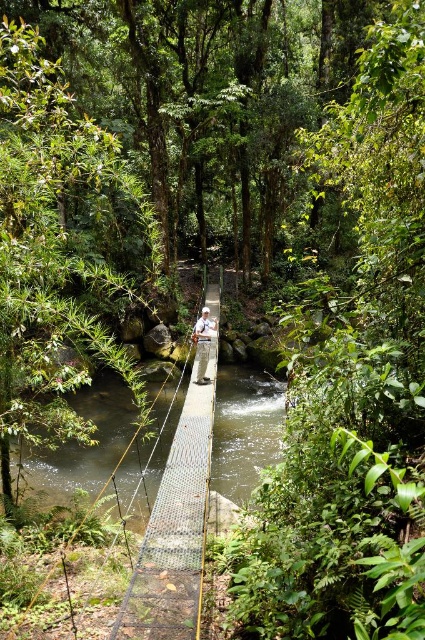
Question: Which point is closer to the camera?

Choices:
 (A) white fabric shirt at center
 (B) clear water at bridge center

Answer: (B)

Question: Does clear water at bridge center come behind white fabric shirt at center?

Choices:
 (A) yes
 (B) no

Answer: (B)

Question: Where is clear water at bridge center located in relation to white fabric shirt at center in the image?

Choices:
 (A) left
 (B) right

Answer: (A)

Question: Can you confirm if clear water at bridge center is smaller than white fabric shirt at center?

Choices:
 (A) yes
 (B) no

Answer: (B)

Question: Which point is closer to the camera?

Choices:
 (A) clear water at bridge center
 (B) white fabric shirt at center

Answer: (A)

Question: Among these points, which one is farthest from the camera?

Choices:
 (A) (204, 365)
 (B) (258, 385)

Answer: (B)